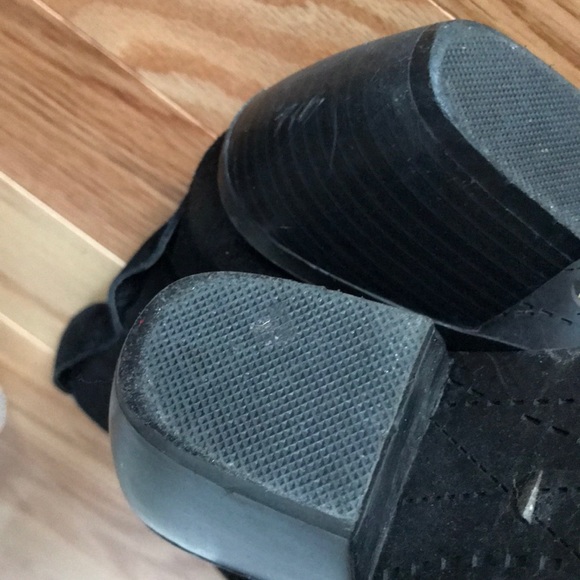
Locate an element on the screen. flooring seams is located at coordinates (452, 10), (148, 83), (78, 233).